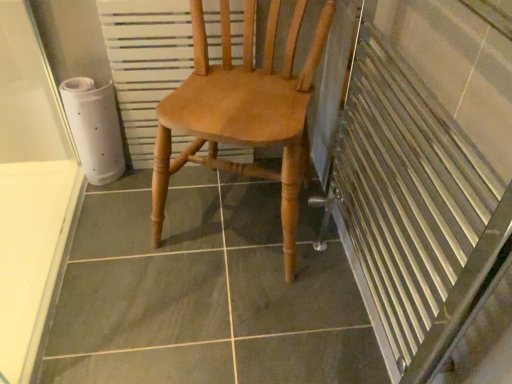
The width and height of the screenshot is (512, 384). What are the coordinates of `free spot in front of light brown wood chair at center` in the screenshot? It's located at (218, 319).